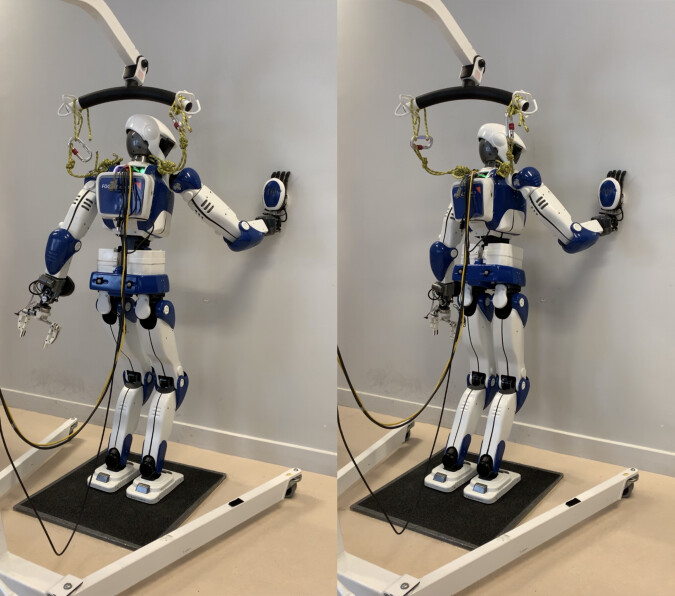
Find the location of a particular element. The width and height of the screenshot is (675, 596). mats is located at coordinates (121, 515), (446, 519).